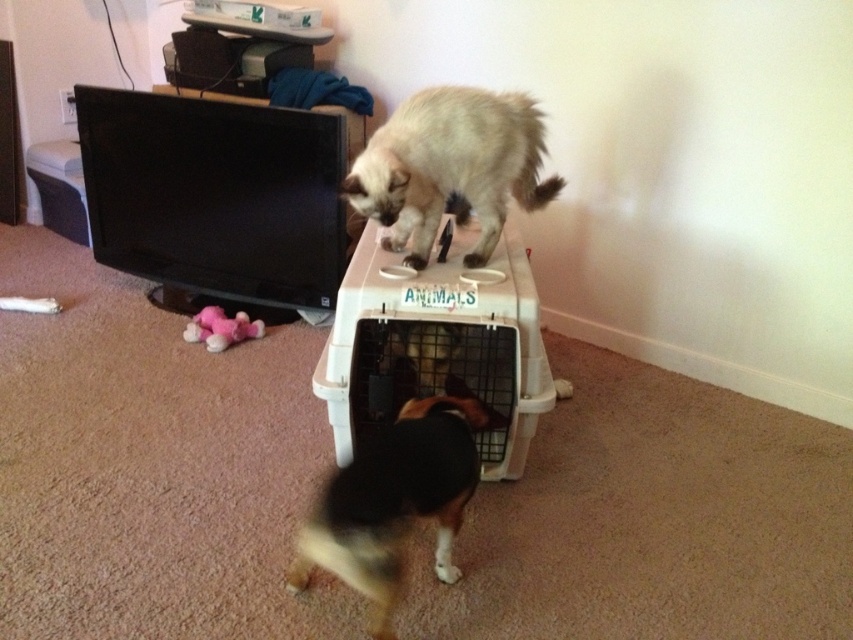
Based on the scene description, where exactly is the light brown fur at upper center located in the image?

The light brown fur at upper center is located at point coordinates of (450, 166).

You are a pet owner who wants to place a new toy between the light brown fur at upper center and the brown and white fur dog at center. Where should you place the toy so it is between them?

The light brown fur at upper center is positioned over the brown and white fur dog at center, so placing the toy directly above the brown and white fur dog at center would position it between the two objects.

You are standing in the living room and see the small dog with a black and brown coat facing the pet carrier. There is also a point labeled at coordinate (450, 166). What is the color of the fur at that point?

The point at coordinate (450, 166) corresponds to the light brown fur at upper center, so the fur there is light brown.